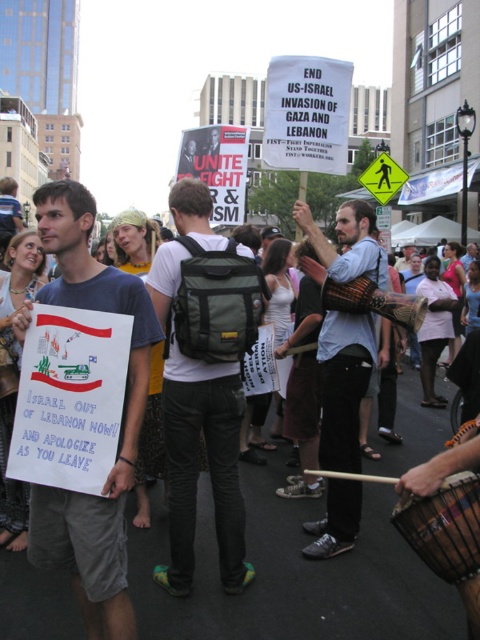
Measure the distance between matte blue t-shirt at center and green fabric backpack at center.

7.51 feet

You are a GUI agent. You are given a task and a screenshot of the screen. Output one action in this format:
    pyautogui.click(x=<x>, y=<y>)
    Task: Click on the matte blue t-shirt at center
    The width and height of the screenshot is (480, 640).
    Given the screenshot: What is the action you would take?
    pyautogui.click(x=121, y=424)

Locate an element on the screen. matte blue t-shirt at center is located at coordinates (121, 424).

Does white paper sign at center have a greater height compared to light blue shirt at center?

No, white paper sign at center is not taller than light blue shirt at center.

Locate an element on the screen. The width and height of the screenshot is (480, 640). white paper sign at center is located at coordinates (279, 554).

You are a GUI agent. You are given a task and a screenshot of the screen. Output one action in this format:
    pyautogui.click(x=<x>, y=<y>)
    Task: Click on the white paper sign at center
    The height and width of the screenshot is (640, 480).
    Given the screenshot: What is the action you would take?
    pyautogui.click(x=279, y=554)

How distant is white paper sign at center from matte blue t-shirt at center?

9.16 feet

You are a GUI agent. You are given a task and a screenshot of the screen. Output one action in this format:
    pyautogui.click(x=<x>, y=<y>)
    Task: Click on the white paper sign at center
    This screenshot has width=480, height=640.
    Given the screenshot: What is the action you would take?
    coord(279,554)

The image size is (480, 640). I want to click on white paper sign at center, so click(x=279, y=554).